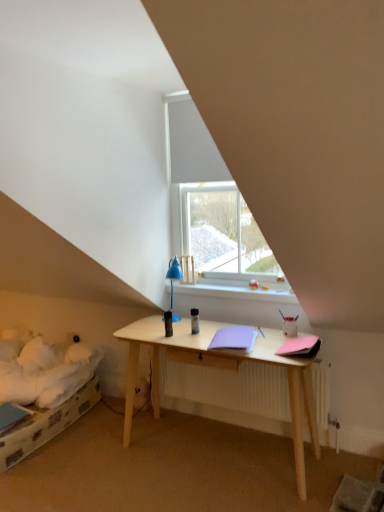
Question: Is white plastic window sill at center directly adjacent to pink matte notebook at right, which ranks as the second notebook in left-to-right order?

Choices:
 (A) no
 (B) yes

Answer: (A)

Question: Does white plastic window sill at center appear on the right side of pink matte notebook at right, which ranks as the second notebook in left-to-right order?

Choices:
 (A) yes
 (B) no

Answer: (B)

Question: Is pink matte notebook at right, which ranks as the second notebook in left-to-right order, inside white plastic window sill at center?

Choices:
 (A) yes
 (B) no

Answer: (B)

Question: Can we say white plastic window sill at center lies outside pink matte notebook at right, positioned as the first notebook in right-to-left order?

Choices:
 (A) yes
 (B) no

Answer: (A)

Question: Is white plastic window sill at center further to the viewer compared to pink matte notebook at right, positioned as the first notebook in right-to-left order?

Choices:
 (A) yes
 (B) no

Answer: (A)

Question: Do you think lavender matte notebook at center, positioned as the first notebook in left-to-right order, is within white plastic window sill at center, or outside of it?

Choices:
 (A) outside
 (B) inside

Answer: (A)

Question: Is lavender matte notebook at center, positioned as the 2th notebook in right-to-left order, wider or thinner than white plastic window sill at center?

Choices:
 (A) wide
 (B) thin

Answer: (A)

Question: Considering the positions of lavender matte notebook at center, positioned as the 2th notebook in right-to-left order, and white plastic window sill at center in the image, is lavender matte notebook at center, positioned as the 2th notebook in right-to-left order, bigger or smaller than white plastic window sill at center?

Choices:
 (A) big
 (B) small

Answer: (B)

Question: Is lavender matte notebook at center, positioned as the 2th notebook in right-to-left order, in front of or behind white plastic window sill at center in the image?

Choices:
 (A) behind
 (B) front

Answer: (B)

Question: Is white plastic window sill at center bigger or smaller than transparent glass window at center?

Choices:
 (A) small
 (B) big

Answer: (A)

Question: Which is correct: white plastic window sill at center is inside transparent glass window at center, or outside of it?

Choices:
 (A) inside
 (B) outside

Answer: (B)

Question: From a real-world perspective, is white plastic window sill at center physically located above or below transparent glass window at center?

Choices:
 (A) below
 (B) above

Answer: (A)

Question: From the image's perspective, is white plastic window sill at center located above or below transparent glass window at center?

Choices:
 (A) below
 (B) above

Answer: (A)

Question: In terms of size, does transparent glass window at center appear bigger or smaller than white plastic window sill at center?

Choices:
 (A) small
 (B) big

Answer: (B)

Question: From a real-world perspective, is transparent glass window at center above or below white plastic window sill at center?

Choices:
 (A) above
 (B) below

Answer: (A)